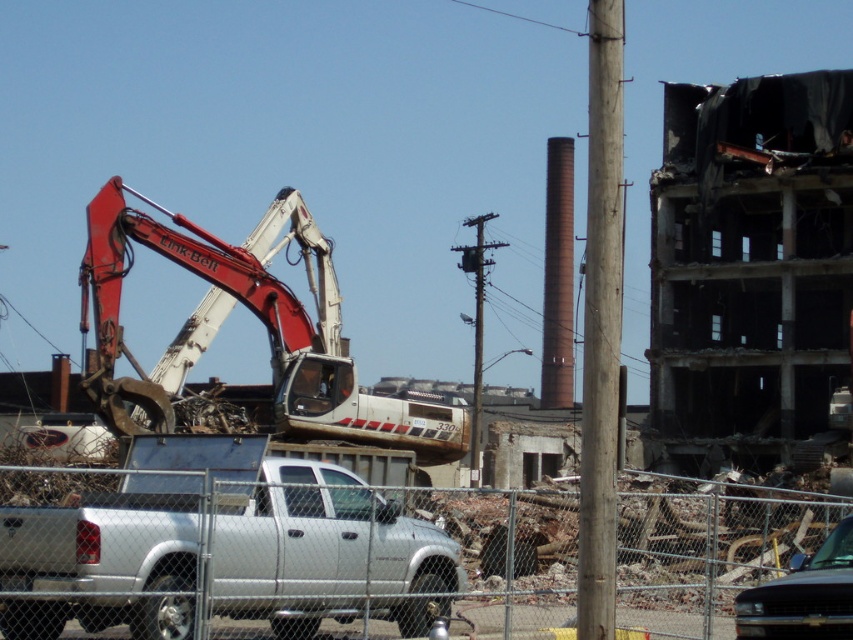
Is silver metallic truck at center to the right of wooden pole at center-right from the viewer's perspective?

Incorrect, silver metallic truck at center is not on the right side of wooden pole at center-right.

Does silver metallic truck at center come behind wooden pole at center-right?

No, silver metallic truck at center is in front of wooden pole at center-right.

This screenshot has height=640, width=853. I want to click on silver metallic truck at center, so click(x=221, y=547).

What are the coordinates of `silver metallic truck at center` in the screenshot? It's located at (221, 547).

Can you confirm if silver metallic truck at center is shorter than matte white excavator at left?

Correct, silver metallic truck at center is not as tall as matte white excavator at left.

Can you confirm if silver metallic truck at center is bigger than matte white excavator at left?

Incorrect, silver metallic truck at center is not larger than matte white excavator at left.

Does point (335, 618) come behind point (410, 417)?

No, (335, 618) is closer to viewer.

The width and height of the screenshot is (853, 640). In order to click on silver metallic truck at center in this screenshot , I will do (221, 547).

Between matte white excavator at left and wooden pole at center-right, which one appears on the left side from the viewer's perspective?

matte white excavator at left

Looking at this image, who is taller, matte white excavator at left or wooden pole at center-right?

wooden pole at center-right

What do you see at coordinates (258, 317) in the screenshot? I see `matte white excavator at left` at bounding box center [258, 317].

Image resolution: width=853 pixels, height=640 pixels. Identify the location of matte white excavator at left. (258, 317).